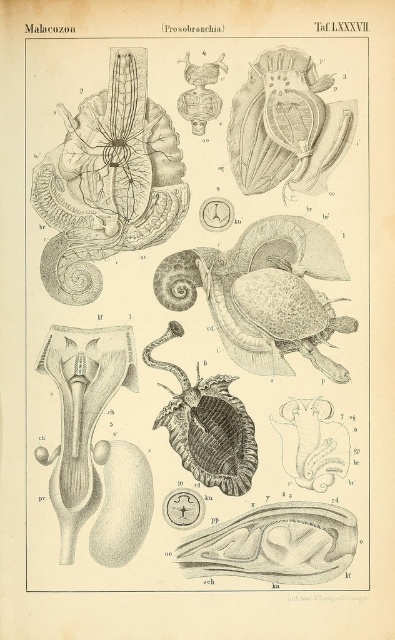
You are a biology student examining the scientific illustration of mollusks. You notice two shells in the image. The first is a smooth beige shell at upper center, and the second is a shiny brown shell at center. Based on their positions, which shell is closer to you?

The smooth beige shell at upper center is closer to you because the shiny brown shell at center is positioned behind it.

Based on the provided scientific illustration labeled as part of the Malacozoa series, which object is positioned lower in the image between the smooth gray shell at center and the smooth beige shell at upper center?

The smooth gray shell at center is positioned below the smooth beige shell at upper center, so it is lower in the image.

In the scientific illustration labeled Taf. LXXXVII, there is a point marked at coordinates [107,180]. Given that the illustration includes a smooth brown snail at the upper left corner, can you identify which anatomical part this point corresponds to?

The point at coordinates [107,180] corresponds to the smooth brown snail at upper left, but without additional anatomical labels or descriptions provided in the scene, it is impossible to determine the specific part it represents.